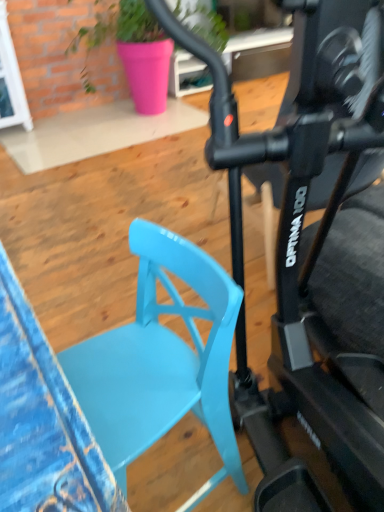
Question: Considering the relative positions of white glossy glass door at upper left and matte black exercise bike at center in the image provided, is white glossy glass door at upper left to the left or to the right of matte black exercise bike at center?

Choices:
 (A) left
 (B) right

Answer: (A)

Question: In terms of size, does white glossy glass door at upper left appear bigger or smaller than matte black exercise bike at center?

Choices:
 (A) small
 (B) big

Answer: (A)

Question: Which is farther from the pink ceramic pot at upper center?

Choices:
 (A) matte black exercise bike at center
 (B) white glossy glass door at upper left
 (C) matte blue chair at center-left

Answer: (C)

Question: Which object is the farthest from the white glossy glass door at upper left?

Choices:
 (A) matte black exercise bike at center
 (B) matte blue chair at center-left
 (C) pink ceramic pot at upper center

Answer: (B)